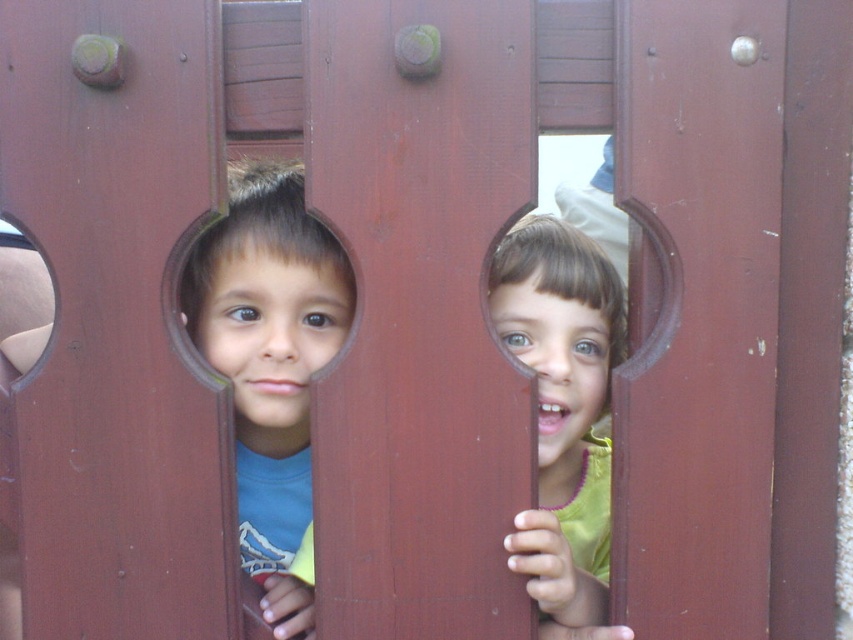
You are a photographer trying to capture both the matte blue shirt at left and the matte green shirt at center through the circular cutouts. Since you want both subjects in focus, which child should you adjust your camera to focus on first?

You should focus on the matte blue shirt at left first because it is closer to the camera than the matte green shirt at center, so adjusting focus starting from the closer subject ensures both can be in focus.

You are standing in front of the wooden structure with the two children. Which child is positioned closer to the center of the wooden structure? The children are the matte blue shirt at left and the light green top at right.

The matte blue shirt at left is positioned closer to the center of the wooden structure because its 2D location is at point (270, 364), which is closer to the center coordinates.

You are standing at the origin point of the coordinate system in the image. The wooden structure has a circular cutout at position point 0.5, 0.3. Can the matte blue shirt at left be seen through the cutout?

The matte blue shirt at left is located at point (x=270, y=364), which is very close to the cutout at (x=254, y=320). Depending on the size of the cutout, it might be possible to see part of the matte blue shirt at left through it, but the exact visibility would depend on the cutout dimensions not provided here.